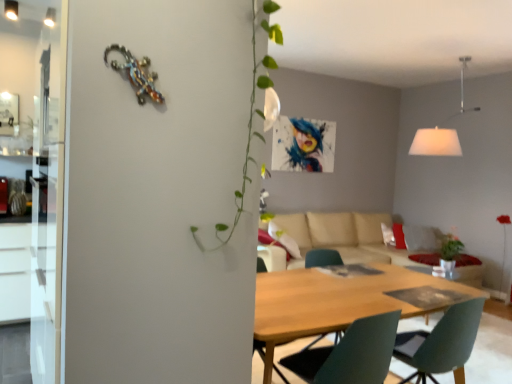
Question: Does wooden table at center have a smaller size compared to white fabric lampshade at upper right?

Choices:
 (A) no
 (B) yes

Answer: (A)

Question: Does wooden table at center have a larger size compared to white fabric lampshade at upper right?

Choices:
 (A) no
 (B) yes

Answer: (B)

Question: Considering the relative positions of wooden table at center and white fabric lampshade at upper right in the image provided, is wooden table at center in front of white fabric lampshade at upper right?

Choices:
 (A) no
 (B) yes

Answer: (B)

Question: From the image's perspective, is wooden table at center located beneath white fabric lampshade at upper right?

Choices:
 (A) yes
 (B) no

Answer: (A)

Question: Can you confirm if wooden table at center is thinner than white fabric lampshade at upper right?

Choices:
 (A) yes
 (B) no

Answer: (A)

Question: In the image, is matte green chair at center on the left side or the right side of white fabric lampshade at upper right?

Choices:
 (A) right
 (B) left

Answer: (B)

Question: From their relative heights in the image, would you say matte green chair at center is taller or shorter than white fabric lampshade at upper right?

Choices:
 (A) tall
 (B) short

Answer: (B)

Question: Based on their sizes in the image, would you say matte green chair at center is bigger or smaller than white fabric lampshade at upper right?

Choices:
 (A) small
 (B) big

Answer: (A)

Question: From the image's perspective, relative to white fabric lampshade at upper right, is matte green chair at center above or below?

Choices:
 (A) below
 (B) above

Answer: (A)

Question: Is matte green chair at center wider or thinner than beige fabric couch at center?

Choices:
 (A) thin
 (B) wide

Answer: (A)

Question: Is matte green chair at center bigger or smaller than beige fabric couch at center?

Choices:
 (A) small
 (B) big

Answer: (A)

Question: Considering the relative positions of matte green chair at center and beige fabric couch at center in the image provided, is matte green chair at center to the left or to the right of beige fabric couch at center?

Choices:
 (A) left
 (B) right

Answer: (A)

Question: Is matte green chair at center situated inside beige fabric couch at center or outside?

Choices:
 (A) outside
 (B) inside

Answer: (A)

Question: From the image's perspective, is matte green chair at center located above or below wooden table at center?

Choices:
 (A) below
 (B) above

Answer: (B)

Question: Is matte green chair at center spatially inside wooden table at center, or outside of it?

Choices:
 (A) outside
 (B) inside

Answer: (B)